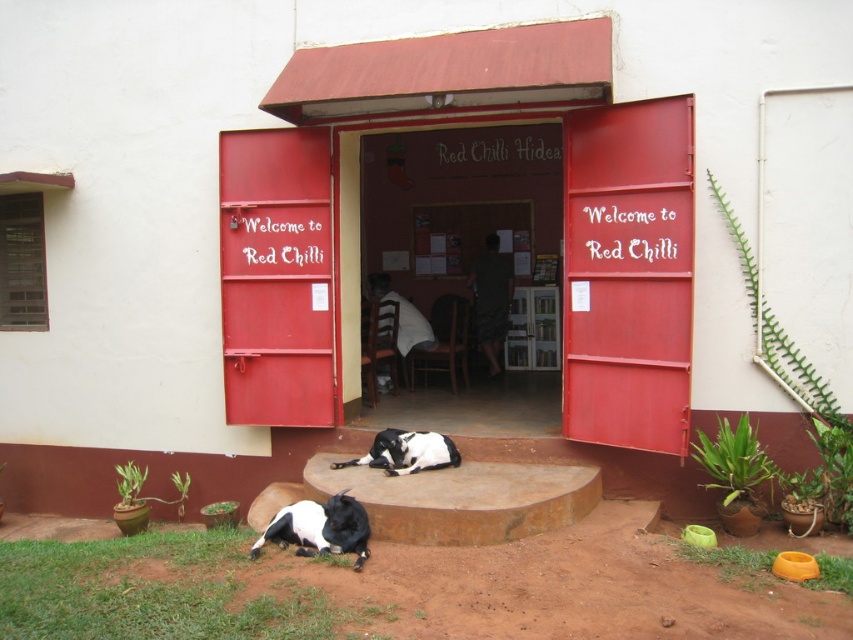
You are a delivery person trying to enter the Red Chilli Hideaway through the entrance. The brown wooden door at center is the main entrance. There is also a black and white fur dog at lower center near the entrance. Considering their sizes, can you step over the dog to go through the door without opening it?

The brown wooden door at center is taller than the black and white fur dog at lower center, so yes, you can step over the dog to go through the door without opening it since the door is higher than the dog.

You are standing at the entrance of Red Chilli Hideaway and want to move towards the point at coordinates point (469, 134) and point (331, 540). Which point should you move toward first if you want to reach the one that is closer to you?

You should move toward point (331, 540) first because it is closer to you than point (469, 134), which is further away.

You are a service robot with a 2 meter long body. You need to move from the entrance to the black and white fur dog at lower center. The brown wooden door at center is in your path. Can you pass through the space between the door and the dog without bending or moving the door?

The brown wooden door at center is 4.55 meters away from the black and white fur dog at lower center. Since the robot is 2 meters long, there is enough space for it to pass through without bending or moving the door.